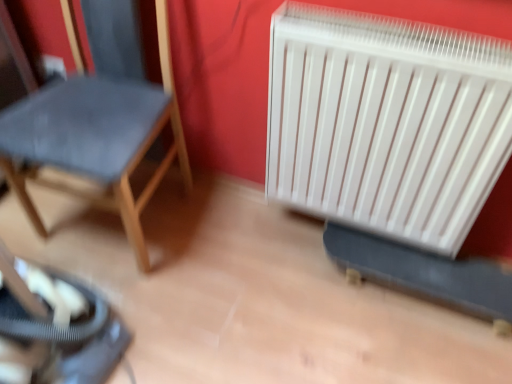
Image resolution: width=512 pixels, height=384 pixels. I want to click on vacant space to the right of velvet blue chair at left, so click(238, 244).